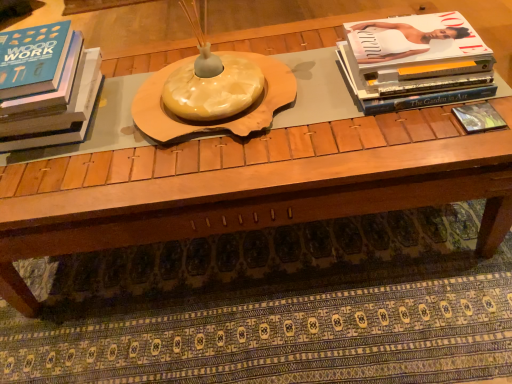
Where is `free space to the left of matte black book at right, marked as the third book in a left-to-right arrangement`? The width and height of the screenshot is (512, 384). free space to the left of matte black book at right, marked as the third book in a left-to-right arrangement is located at coordinates (403, 134).